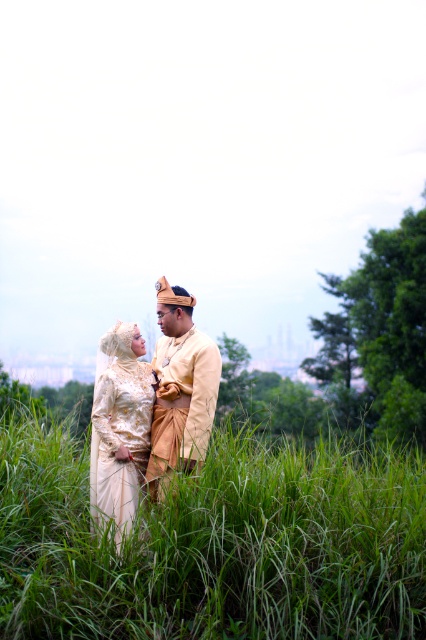
You are a photographer trying to capture the couple in the scene. To ensure the green grassy at center is perfectly framed in the foreground, where should you position your camera relative to the couple?

The green grassy at center is located at point 0.853 on the x and 0.507 on the y coordinates. To frame it in the foreground, position the camera slightly to the right and center of the couple.

You are a photographer who wants to place a decorative stone at the exact center of the image. The image already has a point marked at coordinates point (x=215, y=545). According to the scene description, where is the marked point located?

The point (x=215, y=545) is located at the green grassy area at center.